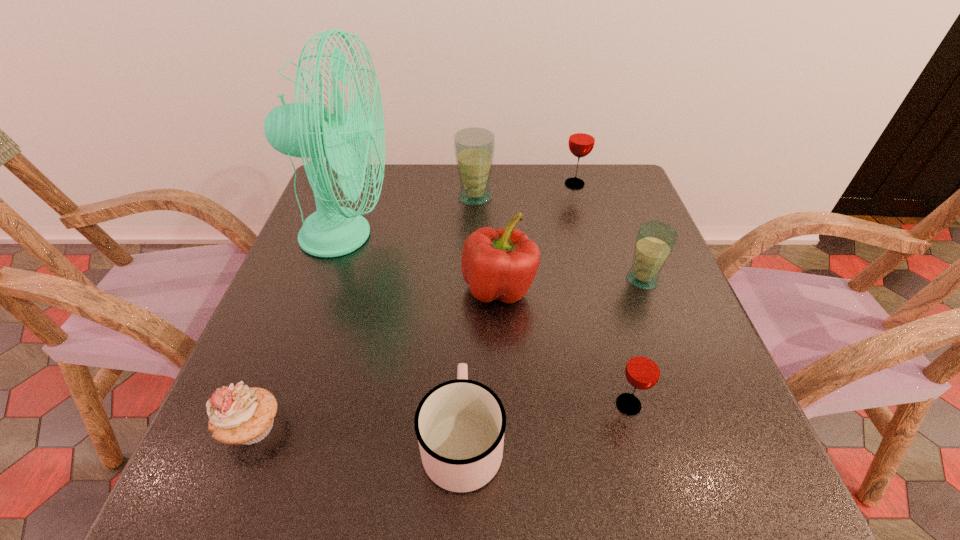
The height and width of the screenshot is (540, 960). I want to click on free space located on the side of the mug with the handle, so click(x=467, y=295).

You are a GUI agent. You are given a task and a screenshot of the screen. Output one action in this format:
    pyautogui.click(x=<x>, y=<y>)
    Task: Click on the vacant area situated 0.250m on the side of the mug with the handle
    
    Given the screenshot: What is the action you would take?
    pyautogui.click(x=467, y=292)

I want to click on fan located in the far edge section of the desktop, so click(305, 130).

Find the location of a particular element. This screenshot has width=960, height=540. cupcake present at the near edge is located at coordinates (238, 414).

The width and height of the screenshot is (960, 540). I want to click on mug located in the near edge section of the desktop, so click(460, 424).

This screenshot has height=540, width=960. What are the coordinates of `fan at the left edge` in the screenshot? It's located at (305, 130).

Where is `cupcake located in the left edge section of the desktop`? Image resolution: width=960 pixels, height=540 pixels. cupcake located in the left edge section of the desktop is located at coordinates [238, 414].

This screenshot has height=540, width=960. Find the location of `object that is at the far left corner`. object that is at the far left corner is located at coordinates (305, 130).

Find the location of a particular element. object that is at the near left corner is located at coordinates (238, 414).

This screenshot has height=540, width=960. Find the location of `object that is at the far right corner`. object that is at the far right corner is located at coordinates (581, 142).